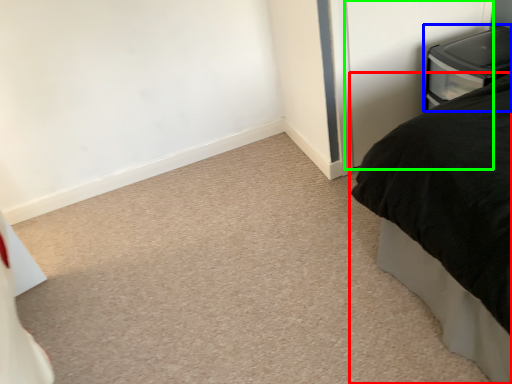
Question: Based on their relative distances, which object is nearer to bed (highlighted by a red box)? Choose from furniture (highlighted by a blue box) and screen door (highlighted by a green box).

Choices:
 (A) furniture
 (B) screen door

Answer: (A)